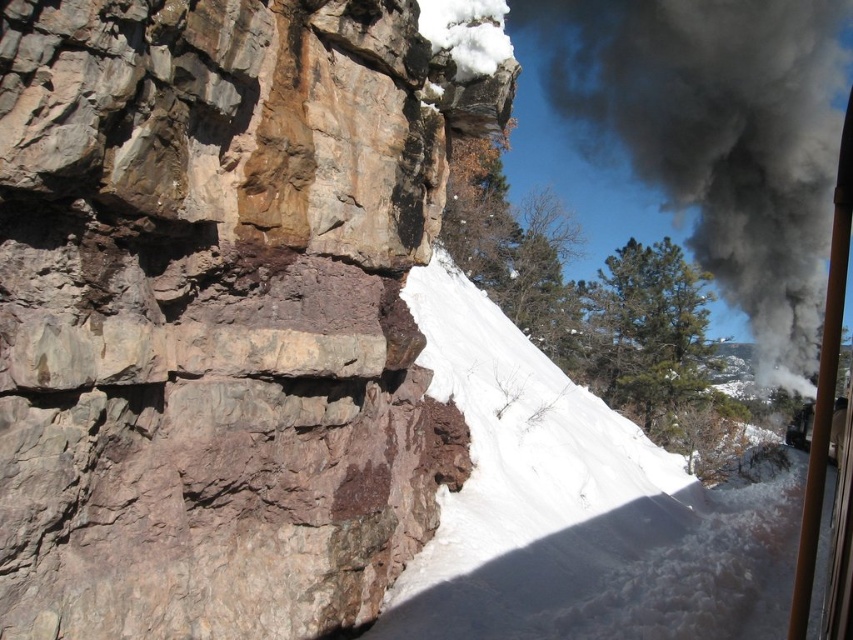
Question: Does rusty stone cliff at center appear under white snow at center?

Choices:
 (A) yes
 (B) no

Answer: (B)

Question: Which point is closer to the camera?

Choices:
 (A) (744, 77)
 (B) (125, 83)
 (C) (633, 525)

Answer: (B)

Question: Which point is farther to the camera?

Choices:
 (A) white snow at center
 (B) rusty stone cliff at center

Answer: (A)

Question: Does white snow at center appear on the right side of black smoke at upper right?

Choices:
 (A) yes
 (B) no

Answer: (B)

Question: Is rusty stone cliff at center to the left of white snow at center from the viewer's perspective?

Choices:
 (A) no
 (B) yes

Answer: (B)

Question: Which object appears farthest from the camera in this image?

Choices:
 (A) black smoke at upper right
 (B) rusty stone cliff at center
 (C) white snow at center

Answer: (A)